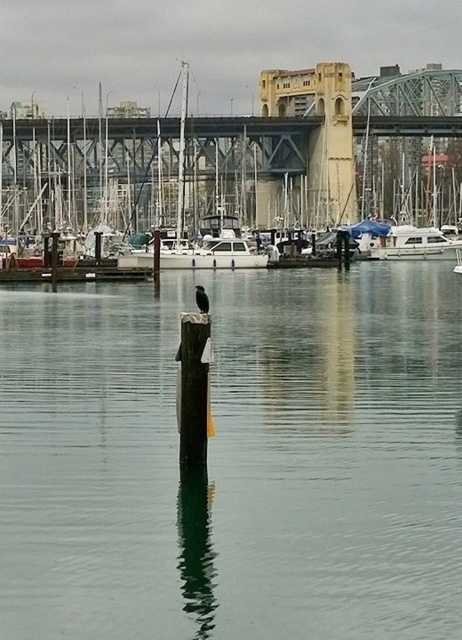
Question: Which object appears farthest from the camera in this image?

Choices:
 (A) white glossy boat at right
 (B) wooden dock at center
 (C) black feathered bird at center
 (D) brown wood post at center

Answer: (A)

Question: Which point appears farthest from the camera in this image?

Choices:
 (A) (206, 426)
 (B) (409, 227)
 (C) (457, 394)

Answer: (B)

Question: Can you confirm if green wood post at center is positioned to the left of white glossy boat at right?

Choices:
 (A) no
 (B) yes

Answer: (B)

Question: Is brown wood post at center closer to camera compared to white glossy boat at right?

Choices:
 (A) yes
 (B) no

Answer: (A)

Question: Does concrete steel bridge at upper center have a greater width compared to black feathered bird at center?

Choices:
 (A) no
 (B) yes

Answer: (B)

Question: Which point is closer to the camera taking this photo?

Choices:
 (A) (200, 285)
 (B) (424, 232)

Answer: (A)